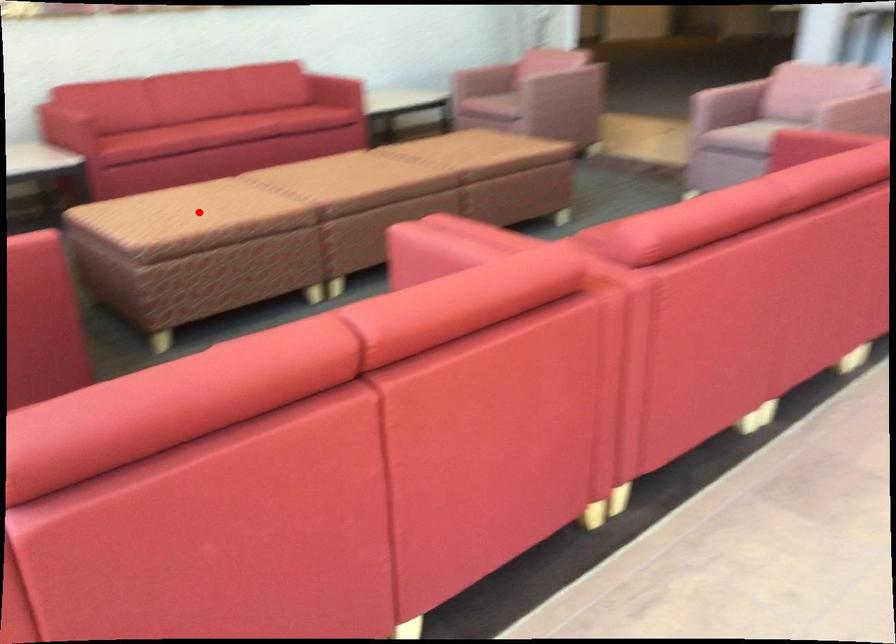
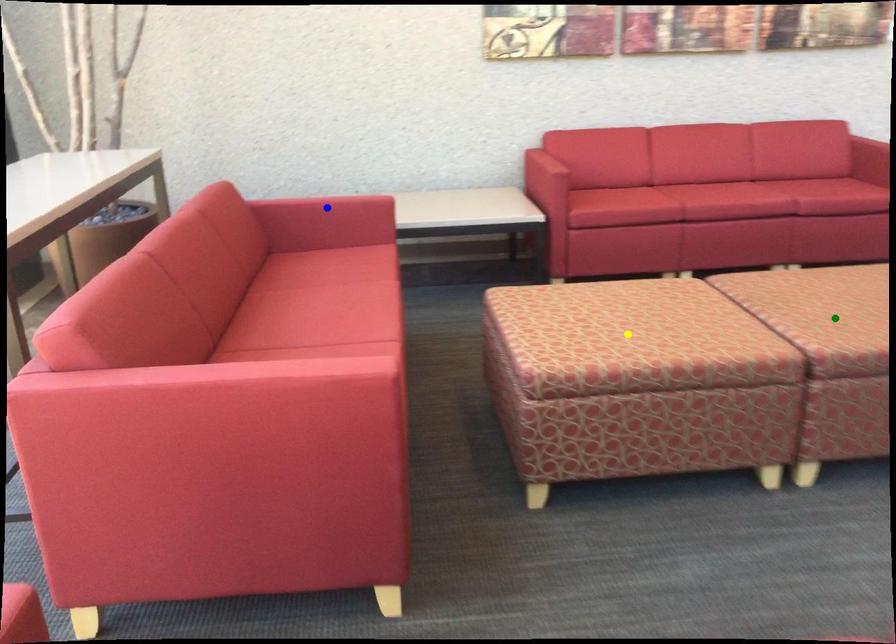
Question: I am providing you with two images of the same scene from different viewpoints. A red point is marked on the first image. You are given multiple points on the second image. Can you choose the point in image 2 that corresponds to the point in image 1?

Choices:
 (A) yellow point
 (B) blue point
 (C) green point

Answer: (A)